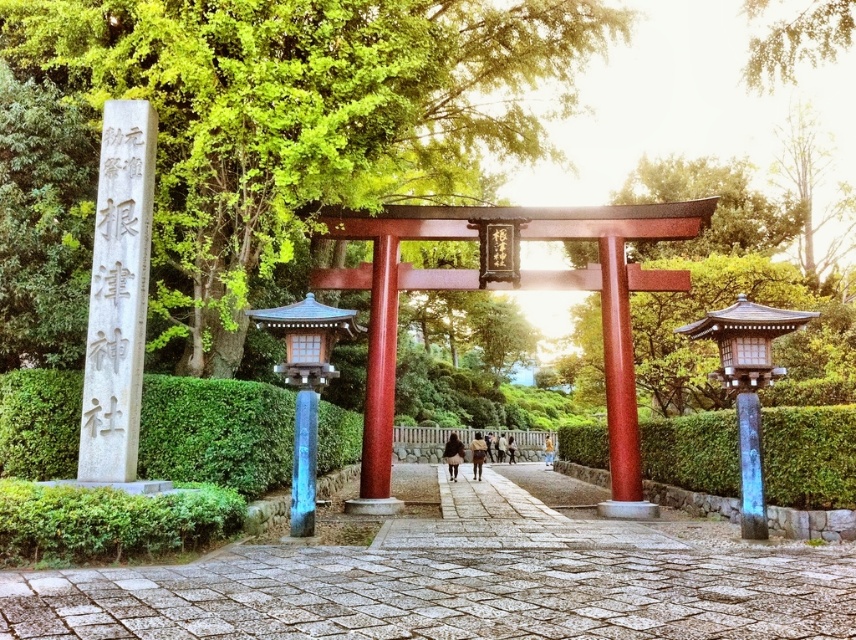
Question: Which of the following is the closest to the observer?

Choices:
 (A) glossy wood pole at center
 (B) wooden lantern at center
 (C) green hedge at center

Answer: (B)

Question: Which point appears closest to the camera in this image?

Choices:
 (A) (753, 401)
 (B) (629, 456)

Answer: (A)

Question: Can you confirm if white stone pillar at left is wider than glossy wood pole at center?

Choices:
 (A) yes
 (B) no

Answer: (A)

Question: Does green hedge at center appear over glossy wood pole at center right?

Choices:
 (A) no
 (B) yes

Answer: (A)

Question: Where is wooden lantern at center located in relation to glossy wood pole at center right in the image?

Choices:
 (A) below
 (B) above

Answer: (A)

Question: Which point is closer to the camera?

Choices:
 (A) (104, 184)
 (B) (722, 556)

Answer: (B)